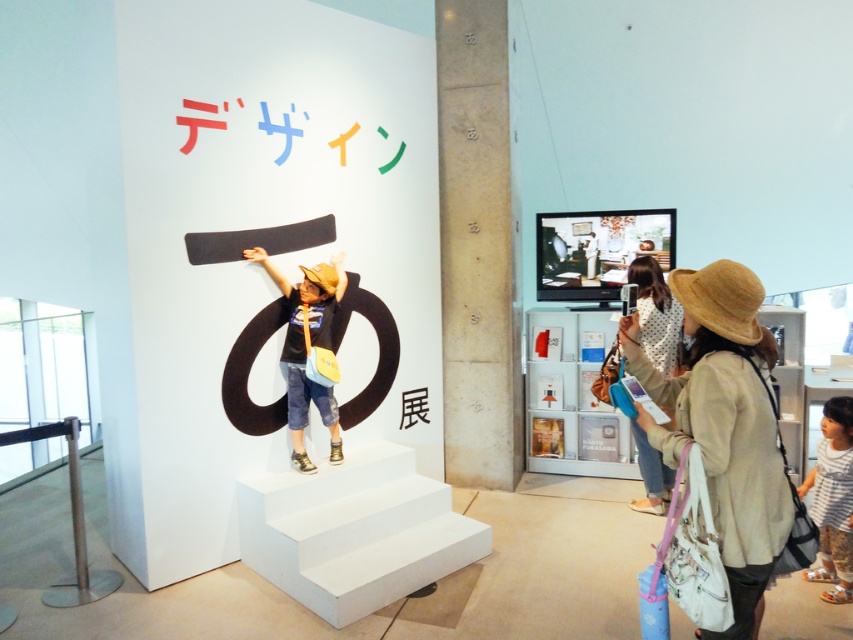
Question: Which is nearer to the denim shorts at center?

Choices:
 (A) light brown straw hat at center
 (B) beige straw hat at right

Answer: (A)

Question: Can you confirm if denim shorts at center is thinner than light brown straw hat at center?

Choices:
 (A) yes
 (B) no

Answer: (B)

Question: Which point is farther to the camera?

Choices:
 (A) (727, 506)
 (B) (292, 433)

Answer: (B)

Question: Which object appears closest to the camera in this image?

Choices:
 (A) beige straw hat at right
 (B) light brown straw hat at center
 (C) denim shorts at center

Answer: (A)

Question: Does beige straw hat at right have a larger size compared to denim shorts at center?

Choices:
 (A) yes
 (B) no

Answer: (A)

Question: Is beige straw hat at right to the left of light brown straw hat at center from the viewer's perspective?

Choices:
 (A) yes
 (B) no

Answer: (A)